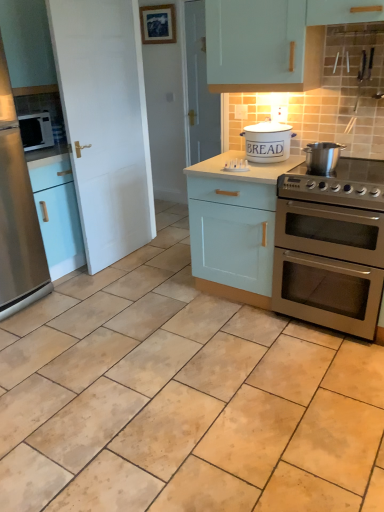
Identify the location of vacant point above light blue wood cabinet at center (from a real-world perspective). (248, 163).